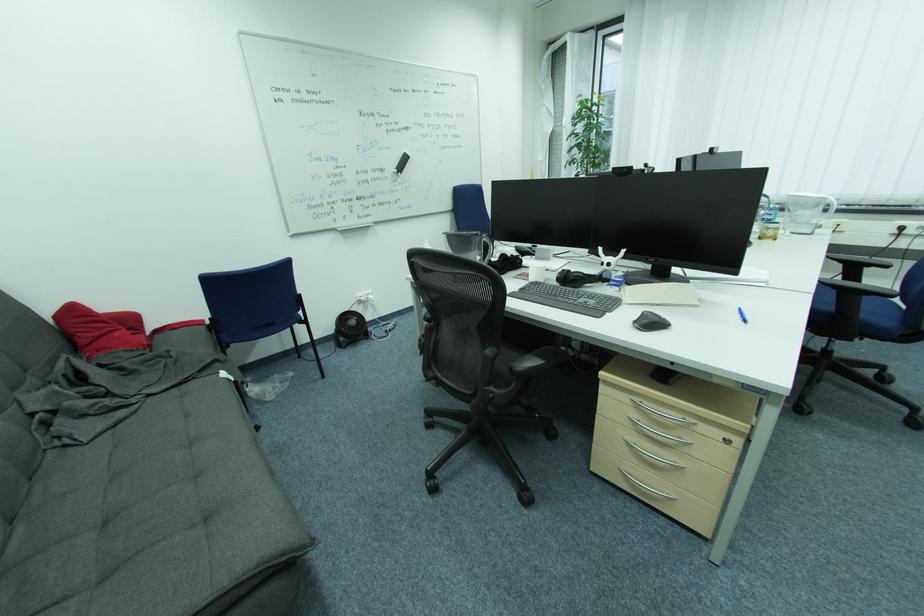
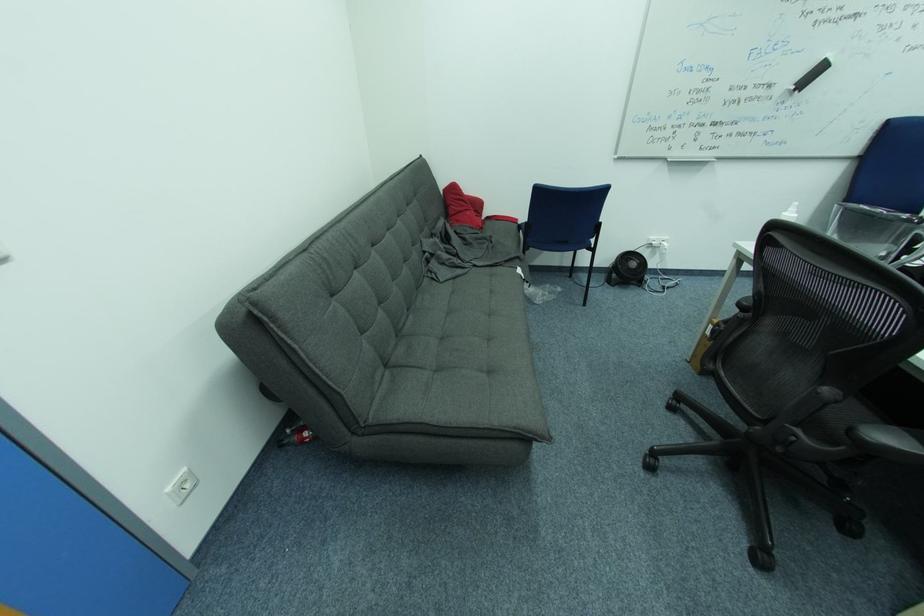
Where in the second image is the point corresponding to (x=345, y=350) from the first image?

(613, 285)